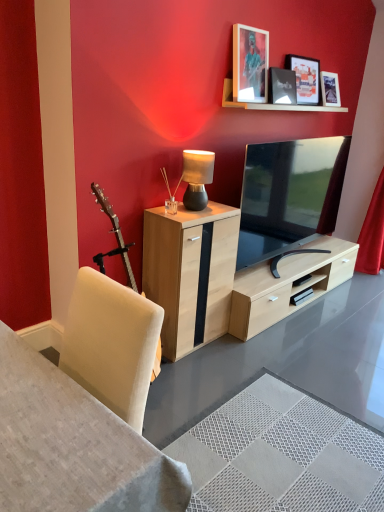
Question: From their relative heights in the image, would you say white fabric desk at lower left is taller or shorter than matte black picture frame at upper center, the 2th picture frame when ordered from left to right?

Choices:
 (A) tall
 (B) short

Answer: (A)

Question: From the image's perspective, is white fabric desk at lower left above or below matte black picture frame at upper center, the second picture frame when ordered from right to left?

Choices:
 (A) above
 (B) below

Answer: (B)

Question: Considering the real-world distances, which object is farthest from the light wood cabinet at center?

Choices:
 (A) matte black table lamp at center
 (B) wooden shelf at upper center
 (C) matte black picture frame at upper center, the second picture frame when ordered from right to left
 (D) red velvet curtain at right
 (E) white fabric desk at lower left

Answer: (D)

Question: Which of these objects is positioned closest to the matte wooden picture frame at upper center, the 3th picture frame positioned from the right?

Choices:
 (A) matte black tv at center
 (B) white fabric desk at lower left
 (C) matte black picture frame at upper center, the second picture frame when ordered from right to left
 (D) wooden shelf at upper center
 (E) light wood cabinet at center

Answer: (D)